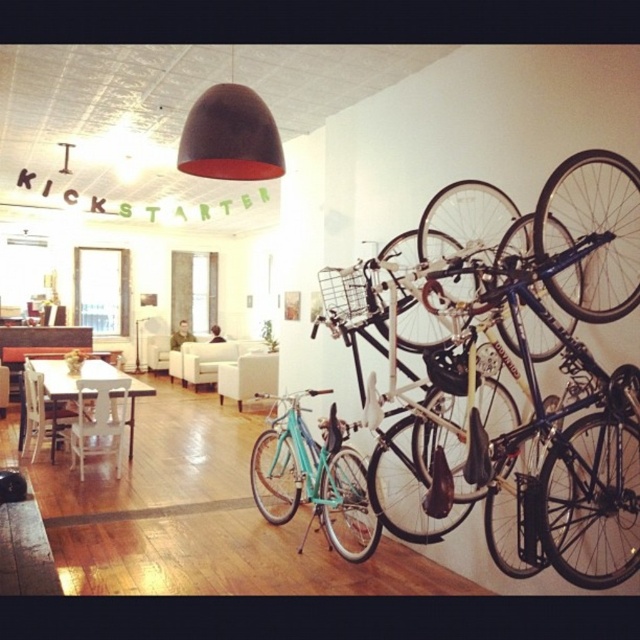
Question: Does teal matte bicycle at right lie in front of white wooden table at center?

Choices:
 (A) no
 (B) yes

Answer: (B)

Question: Which point appears farthest from the camera in this image?

Choices:
 (A) (81, 406)
 (B) (592, 378)
 (C) (65, 394)

Answer: (A)

Question: Considering the real-world distances, which object is closest to the white wooden table at center?

Choices:
 (A) white wood chair at left
 (B) teal matte bicycle at center
 (C) white wood chair at lower left
 (D) teal matte bicycle at right

Answer: (A)

Question: Does teal matte bicycle at center come in front of white wooden table at center?

Choices:
 (A) no
 (B) yes

Answer: (B)

Question: Is teal matte bicycle at right closer to the viewer compared to white wooden table at center?

Choices:
 (A) yes
 (B) no

Answer: (A)

Question: Which object appears closest to the camera in this image?

Choices:
 (A) teal matte bicycle at center
 (B) white wood chair at lower left
 (C) teal matte bicycle at right
 (D) white wooden table at center

Answer: (C)